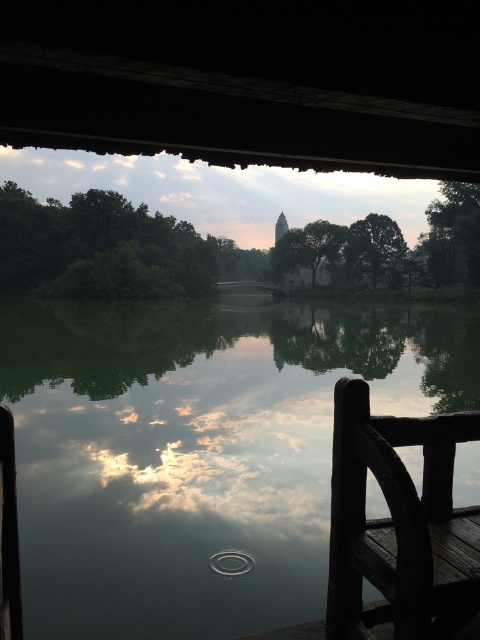
Question: Is the position of green reflective water at center less distant than that of dark wood rail at lower right?

Choices:
 (A) no
 (B) yes

Answer: (A)

Question: Does green reflective water at center have a greater width compared to dark wood rail at lower right?

Choices:
 (A) yes
 (B) no

Answer: (A)

Question: Which object is closer to the camera taking this photo?

Choices:
 (A) dark wood rail at lower right
 (B) green reflective water at center

Answer: (A)

Question: Which point appears farthest from the camera in this image?

Choices:
 (A) (412, 592)
 (B) (120, 608)

Answer: (B)

Question: Can you confirm if green reflective water at center is smaller than dark wood rail at lower right?

Choices:
 (A) no
 (B) yes

Answer: (A)